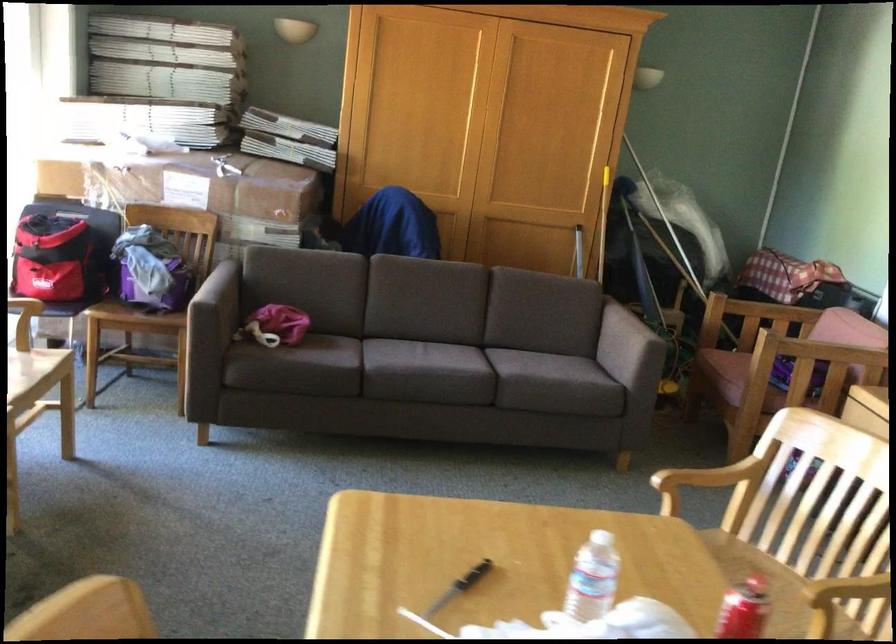
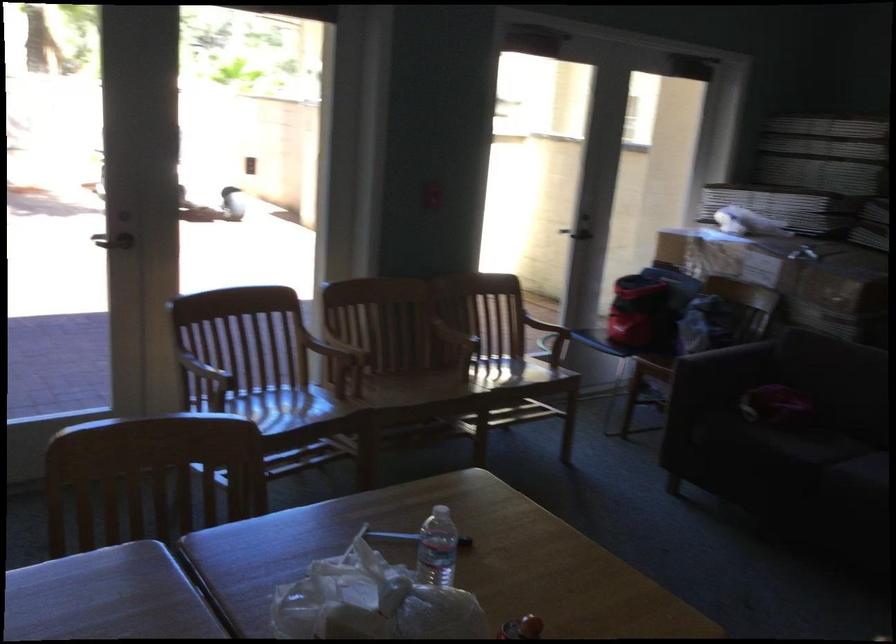
Where in the second image is the point corresponding to [221,449] from the first image?

(673, 488)